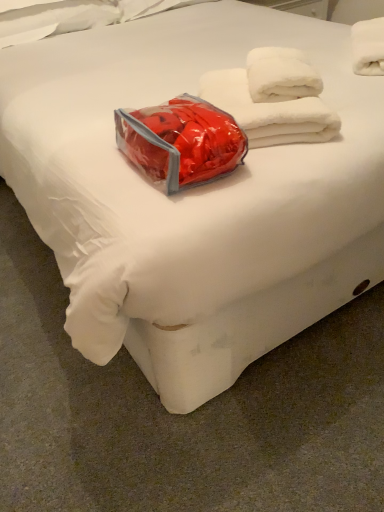
Question: Can you confirm if white fluffy towels at upper right, the first towel from the left, is smaller than shiny plastic bag at center?

Choices:
 (A) no
 (B) yes

Answer: (A)

Question: Is white fluffy towels at upper right, marked as the second towel in a top-to-bottom arrangement, oriented towards shiny plastic bag at center?

Choices:
 (A) no
 (B) yes

Answer: (A)

Question: Could shiny plastic bag at center be considered to be inside white fluffy towels at upper right, marked as the second towel in a top-to-bottom arrangement?

Choices:
 (A) no
 (B) yes

Answer: (A)

Question: Is white fluffy towels at upper right, marked as the second towel in a top-to-bottom arrangement, facing away from shiny plastic bag at center?

Choices:
 (A) no
 (B) yes

Answer: (A)

Question: Is white fluffy towels at upper right, marked as the second towel in a top-to-bottom arrangement, closer to the viewer compared to shiny plastic bag at center?

Choices:
 (A) yes
 (B) no

Answer: (B)

Question: Relative to shiny plastic bag at center, is white fluffy towel at upper right, positioned as the first towel in top-to-bottom order, in front or behind?

Choices:
 (A) front
 (B) behind

Answer: (B)

Question: From a real-world perspective, is white fluffy towel at upper right, positioned as the first towel in top-to-bottom order, above or below shiny plastic bag at center?

Choices:
 (A) below
 (B) above

Answer: (B)

Question: Is white fluffy towel at upper right, positioned as the first towel in top-to-bottom order, situated inside shiny plastic bag at center or outside?

Choices:
 (A) outside
 (B) inside

Answer: (A)

Question: In terms of width, does white fluffy towel at upper right, arranged as the 2th towel when viewed from the left, look wider or thinner when compared to shiny plastic bag at center?

Choices:
 (A) wide
 (B) thin

Answer: (A)

Question: Considering their positions, is white fluffy towel at upper right, placed as the second towel when sorted from bottom to top, located in front of or behind white fluffy towels at upper right, marked as the second towel in a top-to-bottom arrangement?

Choices:
 (A) front
 (B) behind

Answer: (B)

Question: Is point (372, 51) positioned closer to the camera than point (274, 139)?

Choices:
 (A) farther
 (B) closer

Answer: (A)

Question: Considering the relative positions of white fluffy towel at upper right, placed as the second towel when sorted from bottom to top, and white fluffy towels at upper right, which is the 2th towel from right to left, in the image provided, is white fluffy towel at upper right, placed as the second towel when sorted from bottom to top, to the left or to the right of white fluffy towels at upper right, which is the 2th towel from right to left,?

Choices:
 (A) left
 (B) right

Answer: (B)

Question: Is white fluffy towel at upper right, positioned as the first towel in top-to-bottom order, wider or thinner than white fluffy towels at upper right, which is the 2th towel from right to left?

Choices:
 (A) thin
 (B) wide

Answer: (B)

Question: From their relative heights in the image, would you say shiny plastic bag at center is taller or shorter than white fluffy towel at upper right, positioned as the first towel in top-to-bottom order?

Choices:
 (A) short
 (B) tall

Answer: (A)

Question: Looking at their shapes, would you say shiny plastic bag at center is wider or thinner than white fluffy towel at upper right, placed as the second towel when sorted from bottom to top?

Choices:
 (A) thin
 (B) wide

Answer: (A)